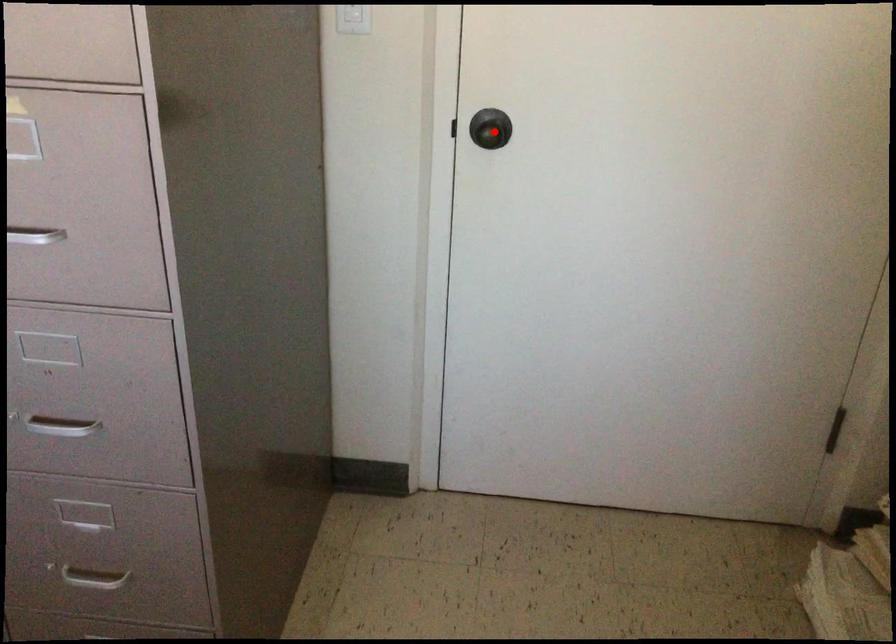
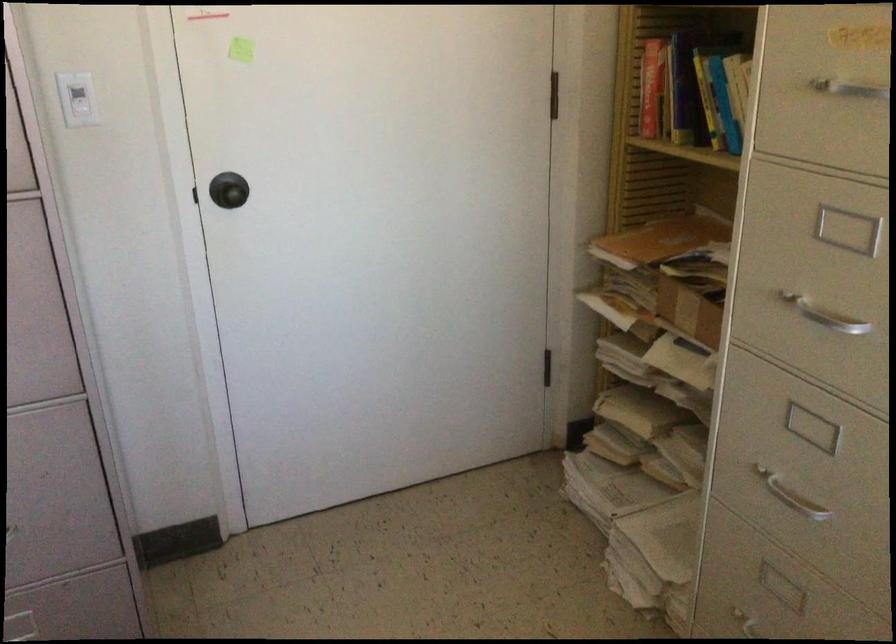
Question: A red point is marked in image1. In image2, is the corresponding 3D point closer to the camera or farther? Reply with the corresponding letter.

Choices:
 (A) The corresponding 3D point is closer.
 (B) The corresponding 3D point is farther.

Answer: (B)